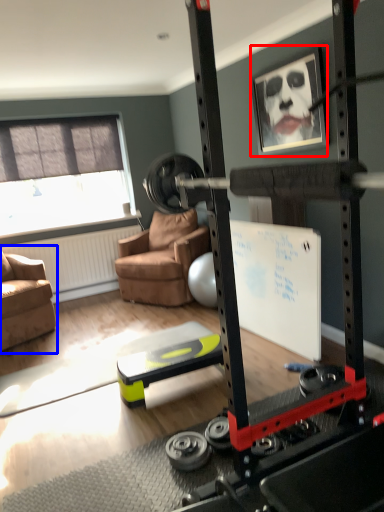
Question: Which of the following is the farthest to the observer, picture frame (highlighted by a red box) or chair (highlighted by a blue box)?

Choices:
 (A) picture frame
 (B) chair

Answer: (B)